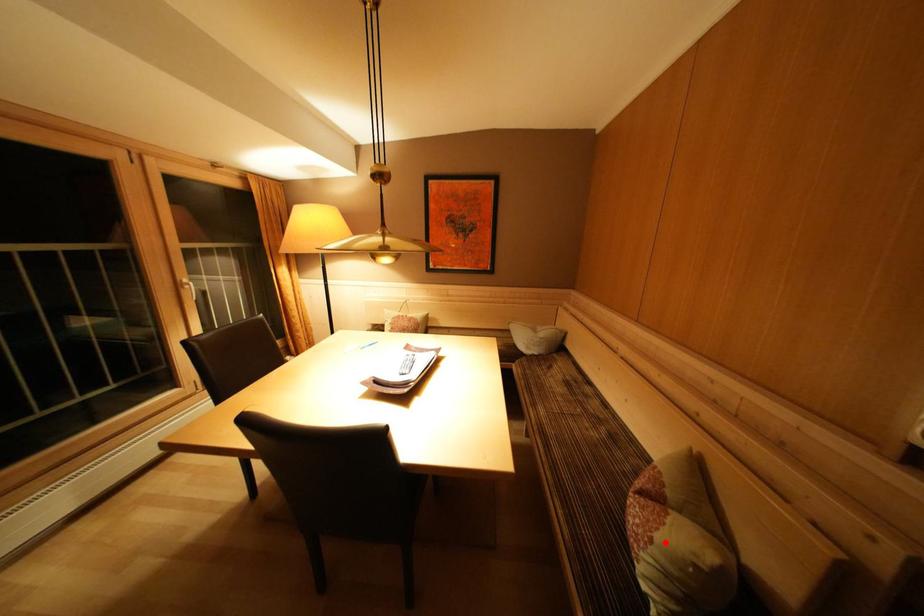
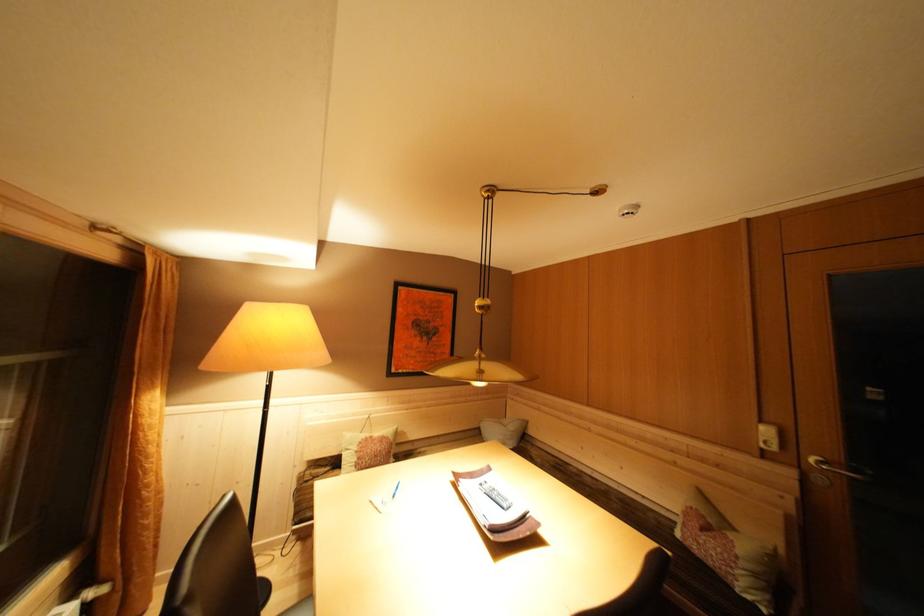
Where in the second image is the point corresponding to the highlighted location from the first image?

(746, 557)